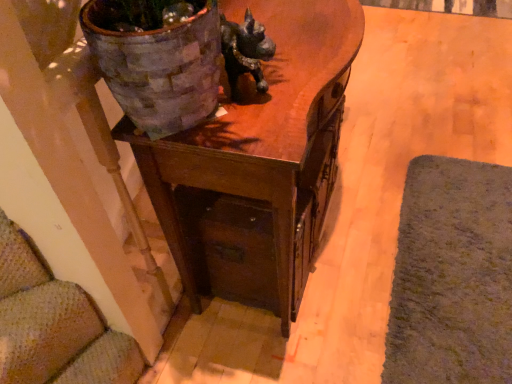
Find the location of `wooden cabinet at center`. wooden cabinet at center is located at coordinates (255, 160).

What is the approximate width of wooden cabinet at center?

The width of wooden cabinet at center is 16.03 inches.

The width and height of the screenshot is (512, 384). What do you see at coordinates (255, 160) in the screenshot?
I see `wooden cabinet at center` at bounding box center [255, 160].

Image resolution: width=512 pixels, height=384 pixels. What are the coordinates of `wooden cabinet at center` in the screenshot? It's located at (255, 160).